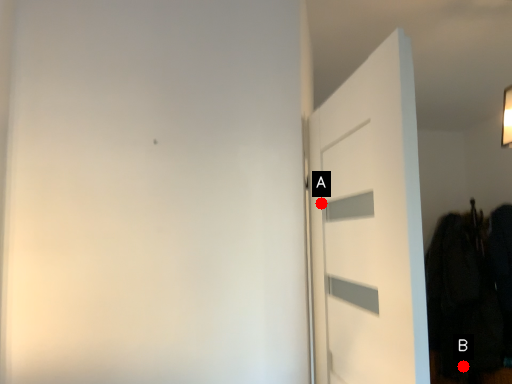
Question: Two points are circled on the image, labeled by A and B beside each circle. Which point is closer to the camera?

Choices:
 (A) A is closer
 (B) B is closer

Answer: (A)